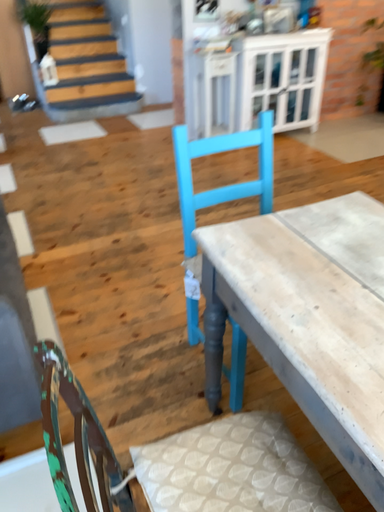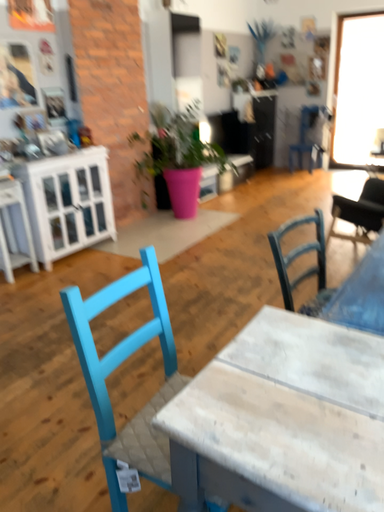
Question: How did the camera likely rotate when shooting the video?

Choices:
 (A) rotated upward
 (B) rotated downward

Answer: (A)